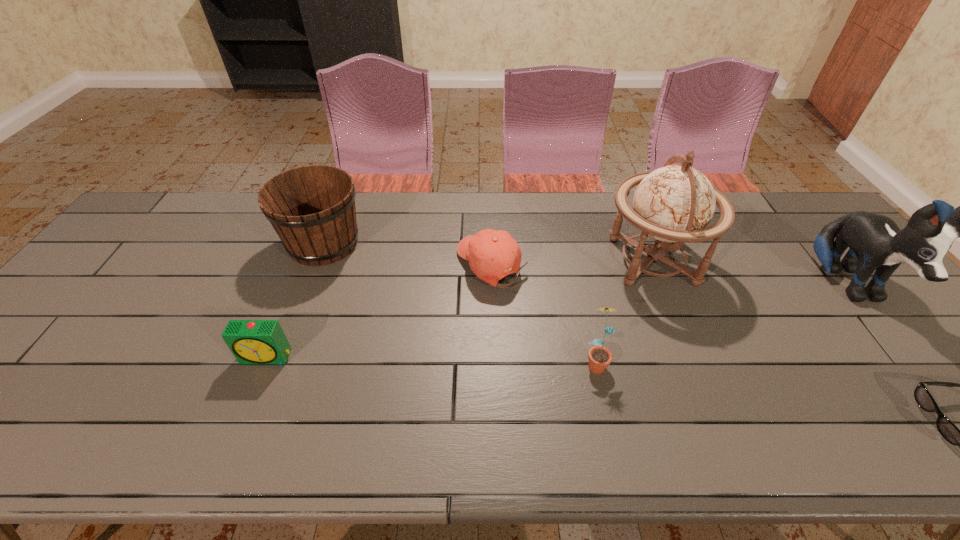
The width and height of the screenshot is (960, 540). In the image, there is a desktop. In order to click on vacant space at the right edge in this screenshot , I will do `click(896, 323)`.

Find the location of `vacant space at the far right corner of the desktop`. vacant space at the far right corner of the desktop is located at coordinates (802, 216).

Locate an element on the screen. free spot between the alarm clock and the sunflower is located at coordinates (431, 359).

Find the location of a particular element. The width and height of the screenshot is (960, 540). vacant area between the puppy and the fifth object from left to right is located at coordinates (750, 274).

What are the coordinates of `vacant space in between the puppy and the alarm clock` in the screenshot? It's located at (558, 322).

The image size is (960, 540). Find the location of `unoccupied area between the sunflower and the fifth object from right to left`. unoccupied area between the sunflower and the fifth object from right to left is located at coordinates (543, 313).

Find the location of `vacant space in between the wine bucket and the alarm clock`. vacant space in between the wine bucket and the alarm clock is located at coordinates (296, 300).

Identify the location of vacant space in between the sunflower and the puppy. This screenshot has width=960, height=540. (722, 324).

Locate an element on the screen. The height and width of the screenshot is (540, 960). object that stands as the fourth closest to the wine bucket is located at coordinates (674, 203).

Locate an element on the screen. the fourth closest object to the third object from right to left is located at coordinates (949, 431).